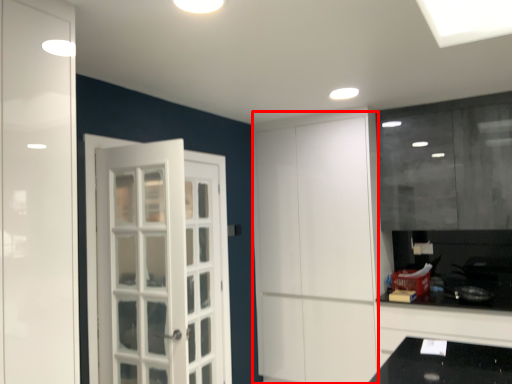
Question: Considering the relative positions of door (annotated by the red box) and cabinetry in the image provided, where is door (annotated by the red box) located with respect to the staircase?

Choices:
 (A) right
 (B) left

Answer: (B)